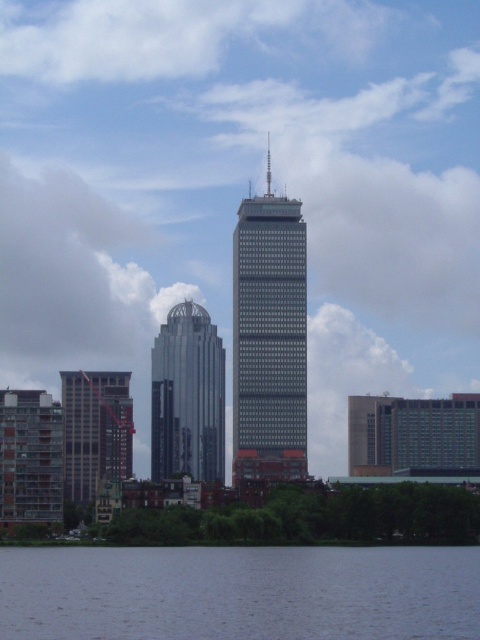
Question: Can you confirm if gray concrete building at left is thinner than glassy concrete building at lower left?

Choices:
 (A) no
 (B) yes

Answer: (A)

Question: Which point is closer to the camera taking this photo?

Choices:
 (A) (216, 456)
 (B) (33, 472)
 (C) (88, 435)
 (D) (396, 573)

Answer: (A)

Question: In this image, where is shiny silver skyscraper at center located relative to gray concrete building at left?

Choices:
 (A) left
 (B) right

Answer: (B)

Question: Which point is farther to the camera?

Choices:
 (A) shiny silver skyscraper at center
 (B) blue water at lower center
 (C) glassy concrete building at lower left
 (D) gray concrete building at left

Answer: (C)

Question: Is shiny silver skyscraper at center thinner than glassy concrete building at lower left?

Choices:
 (A) yes
 (B) no

Answer: (B)

Question: Which point is closer to the camera?

Choices:
 (A) (122, 428)
 (B) (292, 353)
 (C) (45, 493)
 (D) (460, 589)

Answer: (B)